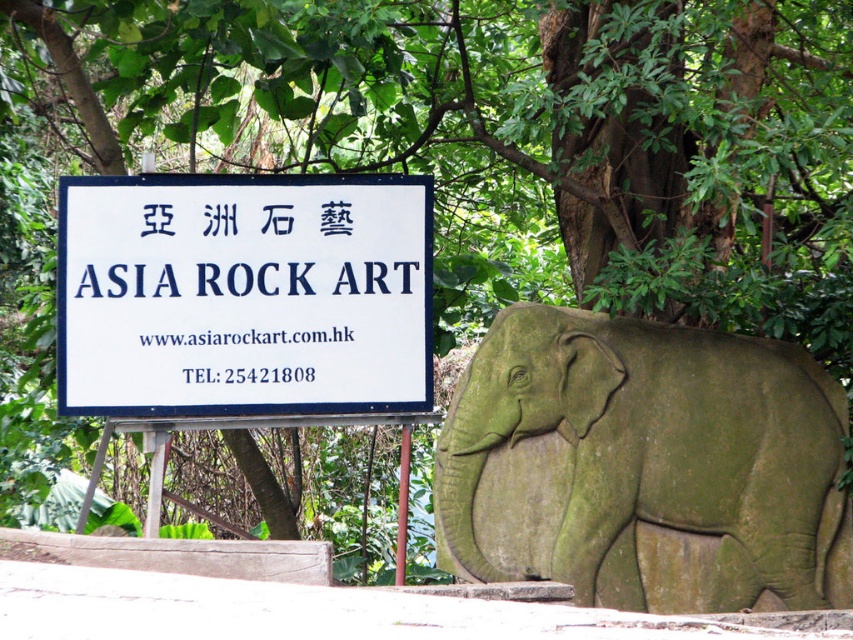
Between point (641, 346) and point (88, 269), which one is positioned in front?

Point (641, 346) is in front.

Which is above, green stone elephant at right or white paper sign at upper center?

white paper sign at upper center is above.

Which is in front, point (492, 465) or point (149, 349)?

Point (492, 465) is in front.

Identify the location of green stone elephant at right. This screenshot has width=853, height=640. (643, 465).